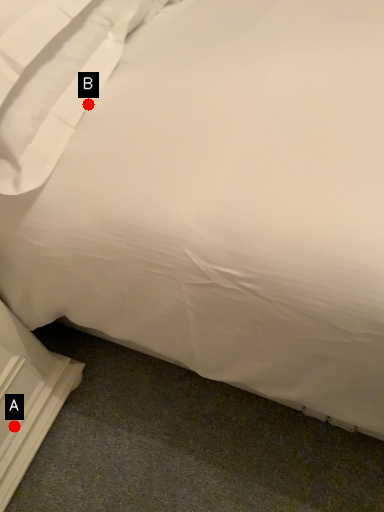
Question: Two points are circled on the image, labeled by A and B beside each circle. Which of the following is the closest to the observer?

Choices:
 (A) A is closer
 (B) B is closer

Answer: (B)